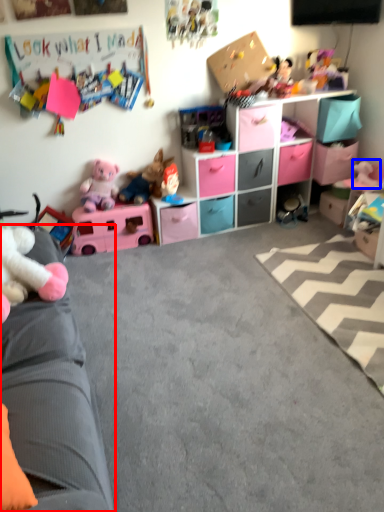
Question: Among these objects, which one is nearest to the camera, studio couch (highlighted by a red box) or toy (highlighted by a blue box)?

Choices:
 (A) studio couch
 (B) toy

Answer: (A)